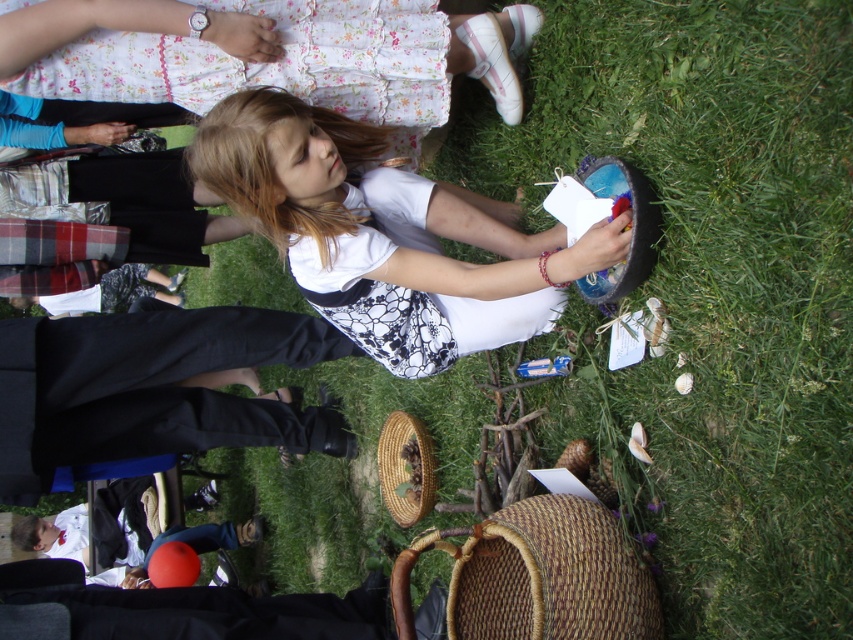
Question: Which point is farther to the camera?

Choices:
 (A) brown woven picnic basket at lower center
 (B) woven brown picnic basket at lower center
 (C) white lace dress at center

Answer: (B)

Question: Which of these objects is positioned farthest from the woven brown picnic basket at lower center?

Choices:
 (A) brown woven picnic basket at lower center
 (B) black fabric pants at lower left

Answer: (A)

Question: Is black fabric pants at lower left behind brown woven picnic basket at lower center?

Choices:
 (A) no
 (B) yes

Answer: (B)

Question: Does black fabric pants at lower left have a lesser width compared to brown woven picnic basket at lower center?

Choices:
 (A) no
 (B) yes

Answer: (A)

Question: Observing the image, what is the correct spatial positioning of white lace dress at center in reference to brown woven picnic basket at lower center?

Choices:
 (A) below
 (B) above

Answer: (B)

Question: Which of the following is the farthest from the observer?

Choices:
 (A) brown woven picnic basket at lower center
 (B) black fabric pants at lower left
 (C) white lace dress at center

Answer: (B)